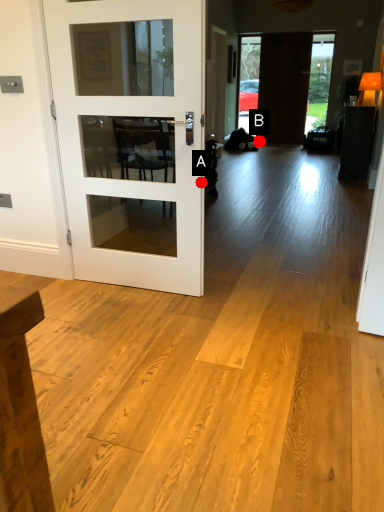
Question: Two points are circled on the image, labeled by A and B beside each circle. Which point is closer to the camera?

Choices:
 (A) A is closer
 (B) B is closer

Answer: (A)